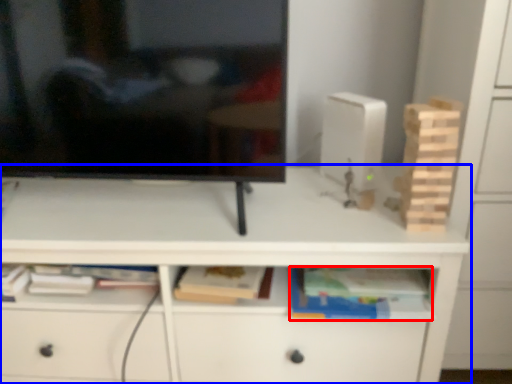
Question: Among these objects, which one is farthest to the camera, book (highlighted by a red box) or desk (highlighted by a blue box)?

Choices:
 (A) book
 (B) desk

Answer: (A)